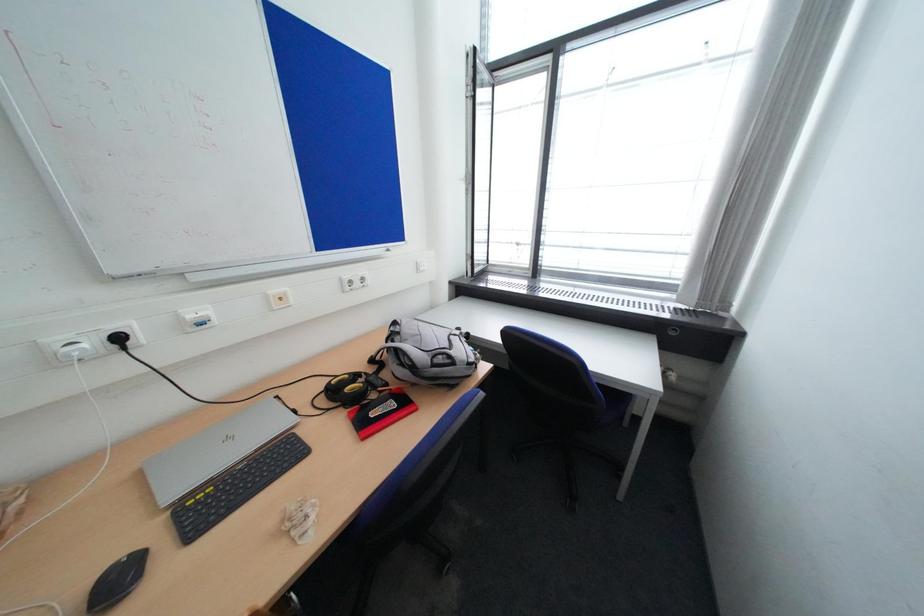
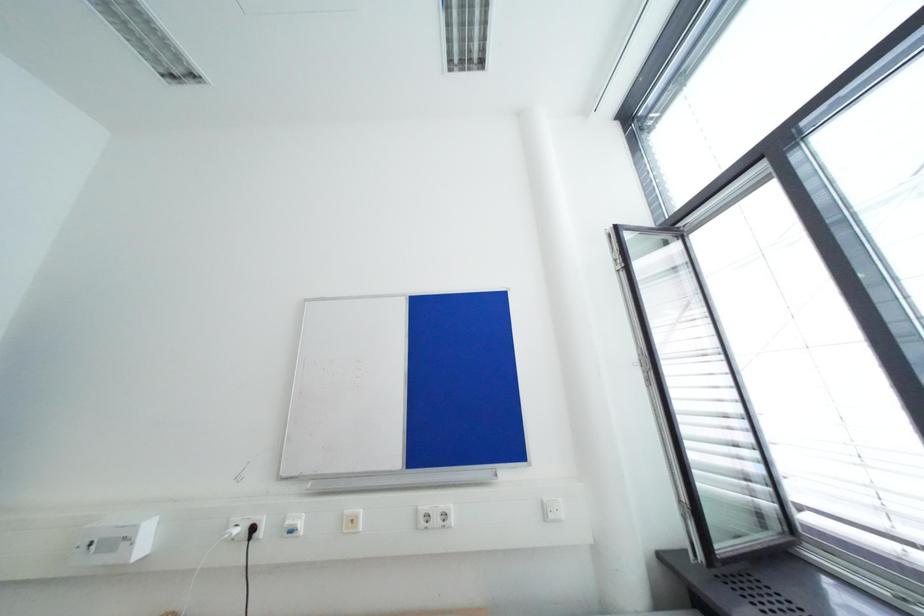
First-person continuous shooting, in which direction is the camera rotating?

The camera's rotation is toward left-up.